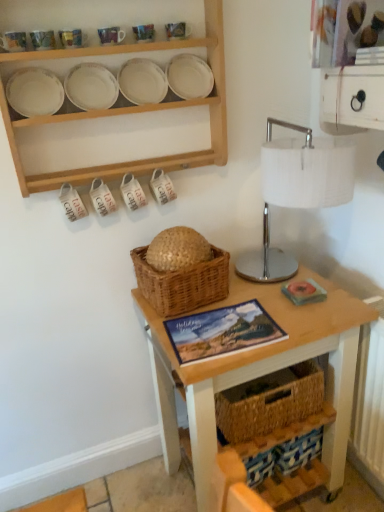
Question: Is matte ceramic mug at upper center, which is counted as the 2th tableware, starting from the right, facing towards matte ceramic mug at upper left, the first tableware from the left?

Choices:
 (A) yes
 (B) no

Answer: (B)

Question: From a real-world perspective, is matte ceramic mug at upper center, placed as the fourth tableware when sorted from left to right, below matte ceramic mug at upper left, the 5th tableware from the right?

Choices:
 (A) no
 (B) yes

Answer: (A)

Question: Does matte ceramic mug at upper center, which is counted as the 2th tableware, starting from the right, have a larger size compared to matte ceramic mug at upper left, the first tableware from the left?

Choices:
 (A) yes
 (B) no

Answer: (B)

Question: Is the position of matte ceramic mug at upper center, placed as the fourth tableware when sorted from left to right, less distant than that of matte ceramic mug at upper left, the first tableware from the left?

Choices:
 (A) yes
 (B) no

Answer: (B)

Question: From the image's perspective, relative to white fabric-covered lamp at upper right, is matte ceramic mug at upper center, which ranks as the 3th tableware in left-to-right order, above or below?

Choices:
 (A) above
 (B) below

Answer: (A)

Question: From a real-world perspective, is matte ceramic mug at upper center, the third tableware in the right-to-left sequence, above or below white fabric-covered lamp at upper right?

Choices:
 (A) above
 (B) below

Answer: (A)

Question: Is point (59, 31) positioned closer to the camera than point (344, 143)?

Choices:
 (A) closer
 (B) farther

Answer: (B)

Question: In terms of size, does matte ceramic mug at upper center, the third tableware in the right-to-left sequence, appear bigger or smaller than white fabric-covered lamp at upper right?

Choices:
 (A) big
 (B) small

Answer: (B)

Question: Considering the relative positions of woven straw basket at center and natural wood plates at upper center in the image provided, is woven straw basket at center to the left or to the right of natural wood plates at upper center?

Choices:
 (A) right
 (B) left

Answer: (A)

Question: From a real-world perspective, is woven straw basket at center physically located above or below natural wood plates at upper center?

Choices:
 (A) below
 (B) above

Answer: (A)

Question: In the image, is woven straw basket at center positioned in front of or behind natural wood plates at upper center?

Choices:
 (A) front
 (B) behind

Answer: (B)

Question: From the image's perspective, relative to natural wood plates at upper center, is woven straw basket at center above or below?

Choices:
 (A) below
 (B) above

Answer: (A)

Question: From the image's perspective, relative to matte ceramic mug at upper left, the 5th tableware from the right, is matte ceramic mug at upper center, placed as the fourth tableware when sorted from left to right, above or below?

Choices:
 (A) below
 (B) above

Answer: (B)

Question: Relative to matte ceramic mug at upper left, the first tableware from the left, is matte ceramic mug at upper center, which is counted as the 2th tableware, starting from the right, in front or behind?

Choices:
 (A) front
 (B) behind

Answer: (B)